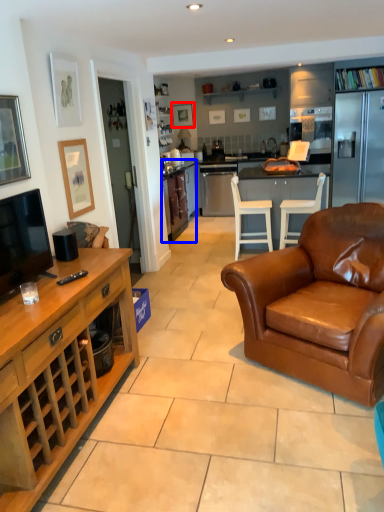
Question: Which point is further to the camera, picture frame (highlighted by a red box) or cabinetry (highlighted by a blue box)?

Choices:
 (A) picture frame
 (B) cabinetry

Answer: (A)